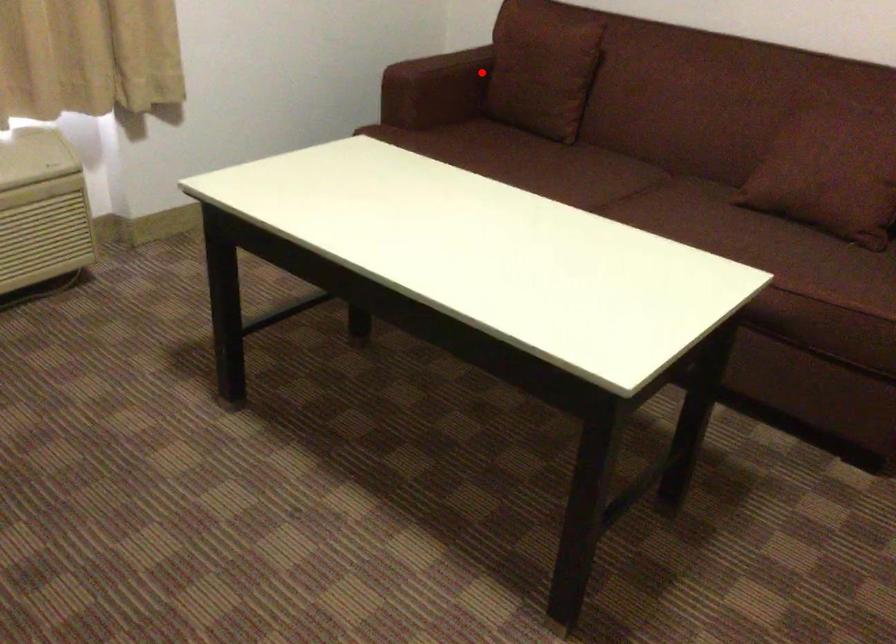
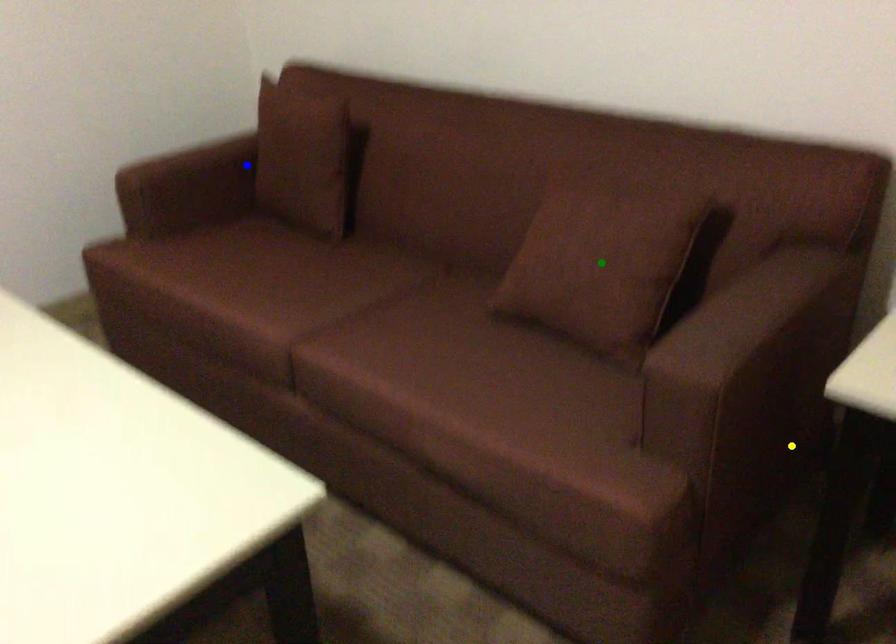
Question: I am providing you with two images of the same scene from different viewpoints. A red point is marked on the first image. You are given multiple points on the second image. In image 2, which mark is for the same physical point as the one in image 1?

Choices:
 (A) blue point
 (B) yellow point
 (C) green point

Answer: (A)